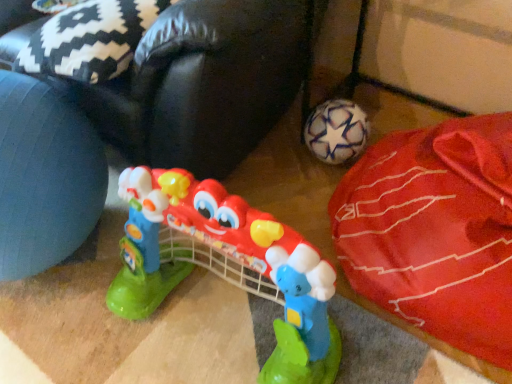
Question: From a real-world perspective, is white matte soccer ball at lower right positioned above or below red fabric bean bag at lower right?

Choices:
 (A) below
 (B) above

Answer: (A)

Question: Is point (434, 289) positioned closer to the camera than point (273, 97)?

Choices:
 (A) farther
 (B) closer

Answer: (B)

Question: Which object is positioned farthest from the plastic toy guitar at center?

Choices:
 (A) white matte soccer ball at lower right
 (B) red fabric bean bag at lower right

Answer: (A)

Question: Which object is positioned closest to the red fabric bean bag at lower right?

Choices:
 (A) white matte soccer ball at lower right
 (B) plastic toy guitar at center

Answer: (B)